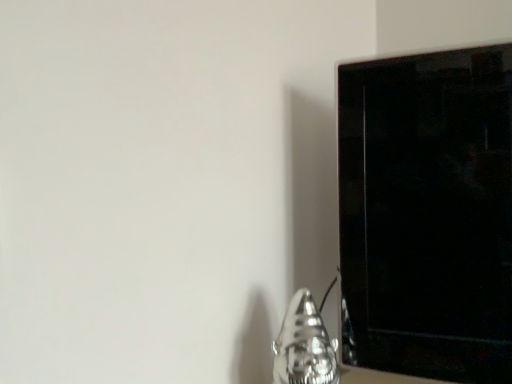
Question: Considering the positions of point (305, 362) and point (382, 87), is point (305, 362) closer or farther from the camera than point (382, 87)?

Choices:
 (A) closer
 (B) farther

Answer: (A)

Question: Is shiny metallic gnome at lower right inside the boundaries of black glossy tv at right, or outside?

Choices:
 (A) outside
 (B) inside

Answer: (A)

Question: Is shiny metallic gnome at lower right to the left or to the right of black glossy tv at right in the image?

Choices:
 (A) left
 (B) right

Answer: (A)

Question: Considering the positions of black glossy tv at right and shiny metallic gnome at lower right in the image, is black glossy tv at right bigger or smaller than shiny metallic gnome at lower right?

Choices:
 (A) big
 (B) small

Answer: (A)

Question: From a real-world perspective, is black glossy tv at right physically located above or below shiny metallic gnome at lower right?

Choices:
 (A) above
 (B) below

Answer: (A)

Question: From the image's perspective, relative to shiny metallic gnome at lower right, is black glossy tv at right above or below?

Choices:
 (A) above
 (B) below

Answer: (A)

Question: Considering the positions of point (465, 352) and point (285, 357), is point (465, 352) closer or farther from the camera than point (285, 357)?

Choices:
 (A) closer
 (B) farther

Answer: (B)